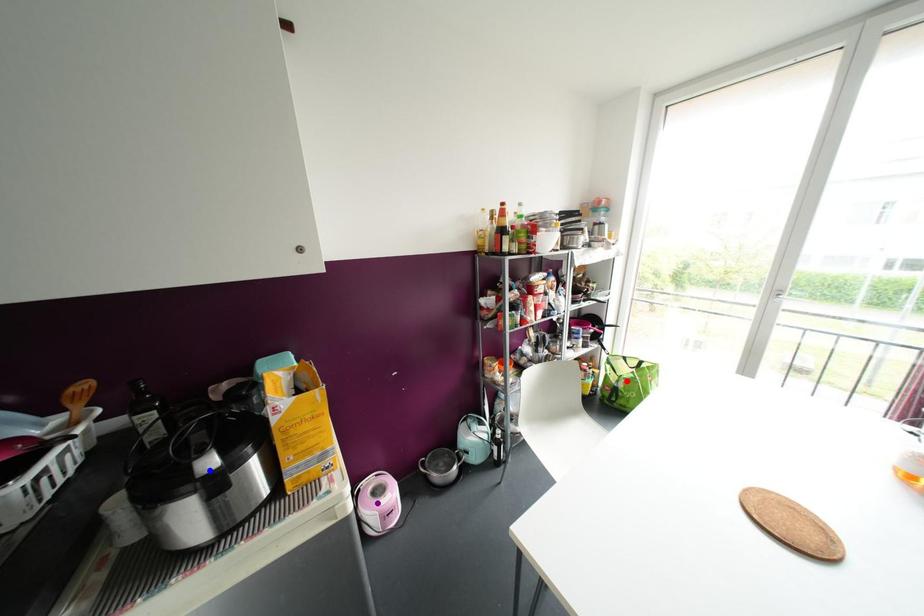
Order these from nearest to farthest:
A) red point
B) purple point
C) blue point

blue point < purple point < red point